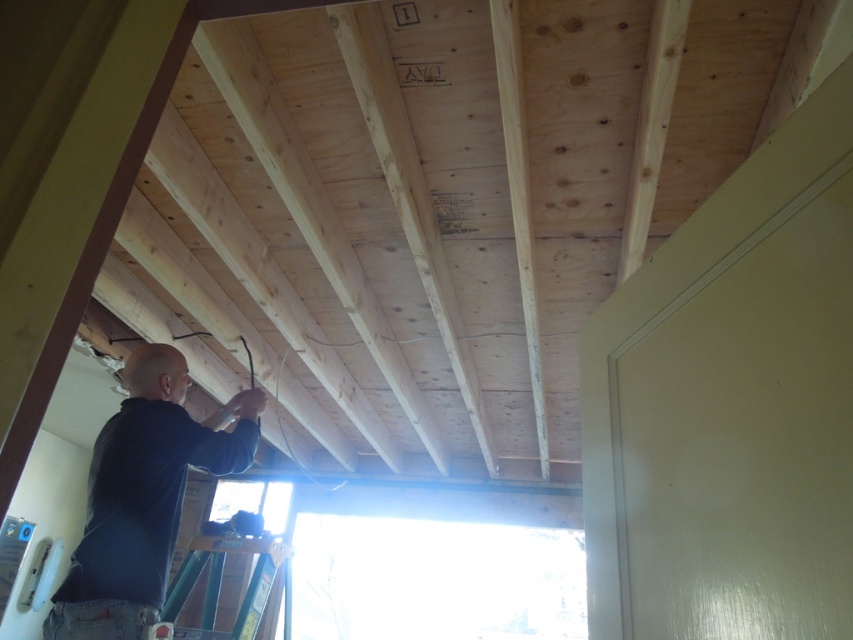
You are a safety inspector checking the construction site. You notice the dark blue shirt at lower left and the green metallic ladder at lower left. According to safety protocols, workers should not leave tools or clothing on ladders. Is there a violation here?

Yes, there is a violation because the dark blue shirt at lower left is positioned over the green metallic ladder at lower left, which violates safety protocols against leaving items on ladders.

You are standing on the green ladder in the construction scene. You need to reach two points marked on the ceiling for installing a beam. The points are labeled as point 1 at coordinates point (90, 486) and point 2 at coordinates point (207, 586). Which point should you reach first if you want to work from the closest point to the farthest point?

You should reach point 1 at coordinates point (90, 486) first because it is closer to you than point 2 at coordinates point (207, 586).